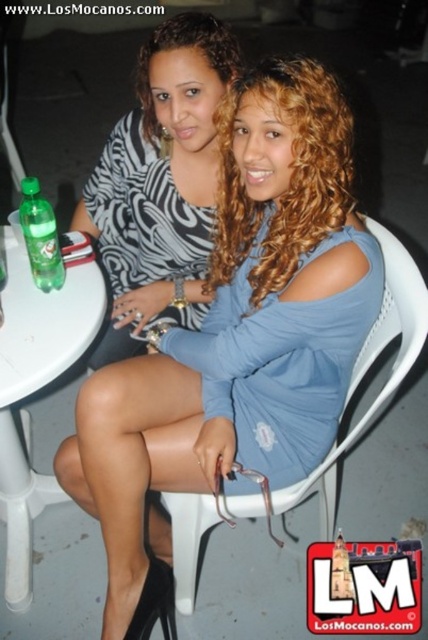
Is blue fabric dress at center below blonde curly hair at center?

Yes, blue fabric dress at center is below blonde curly hair at center.

Between point (312, 460) and point (278, 76), which one is positioned behind?

The point (312, 460) is more distant.

Does point (267, 470) come closer to viewer compared to point (297, 64)?

That is False.

Where is `blue fabric dress at center`? blue fabric dress at center is located at coordinates point(237,336).

Does point (288, 109) come in front of point (213, 35)?

Yes, point (288, 109) is in front of point (213, 35).

Can you confirm if blonde curly hair at center is positioned above matte black blouse at upper center?

Actually, blonde curly hair at center is below matte black blouse at upper center.

Locate an element on the screen. Image resolution: width=428 pixels, height=640 pixels. blonde curly hair at center is located at coordinates (x=290, y=179).

I want to click on blonde curly hair at center, so click(x=290, y=179).

Which of these two, white plastic chair at center or matte black blouse at upper center, stands shorter?

matte black blouse at upper center

Is point (386, 312) positioned after point (216, 22)?

Yes, it is behind point (216, 22).

Where is `white plastic chair at center`? Image resolution: width=428 pixels, height=640 pixels. white plastic chair at center is located at coordinates (368, 369).